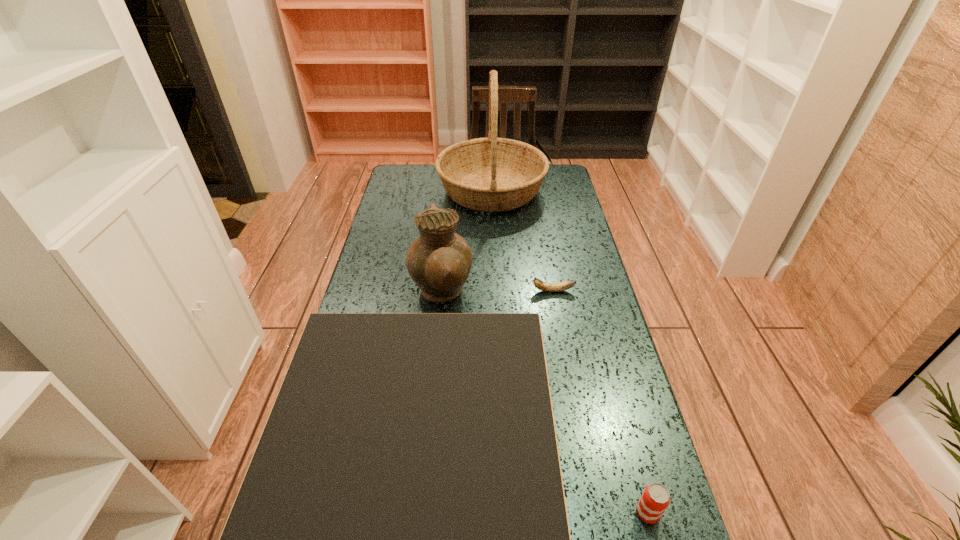
Locate an element on the screen. The width and height of the screenshot is (960, 540). vacant region at the far left corner of the desktop is located at coordinates (405, 166).

Find the location of a particular element. The image size is (960, 540). free space between the beer can and the basket is located at coordinates (569, 352).

Where is `vacant space that is in between the basket and the shortest object`? This screenshot has width=960, height=540. vacant space that is in between the basket and the shortest object is located at coordinates (522, 240).

I want to click on unoccupied area between the rightmost object and the basket, so click(569, 352).

The height and width of the screenshot is (540, 960). Identify the location of vacant space in between the tallest object and the pitcher. pos(467,242).

What are the coordinates of `object identified as the second closest to the shortest object` in the screenshot? It's located at (400, 539).

This screenshot has width=960, height=540. Identify the location of object that can be found as the fourth closest to the tallest object. (655, 499).

Where is `vacant space that satisfies the following two spatial constraints: 1. at the spout of the pitcher; 2. on the left side of the fourth tallest object`? Image resolution: width=960 pixels, height=540 pixels. vacant space that satisfies the following two spatial constraints: 1. at the spout of the pitcher; 2. on the left side of the fourth tallest object is located at coordinates (420, 512).